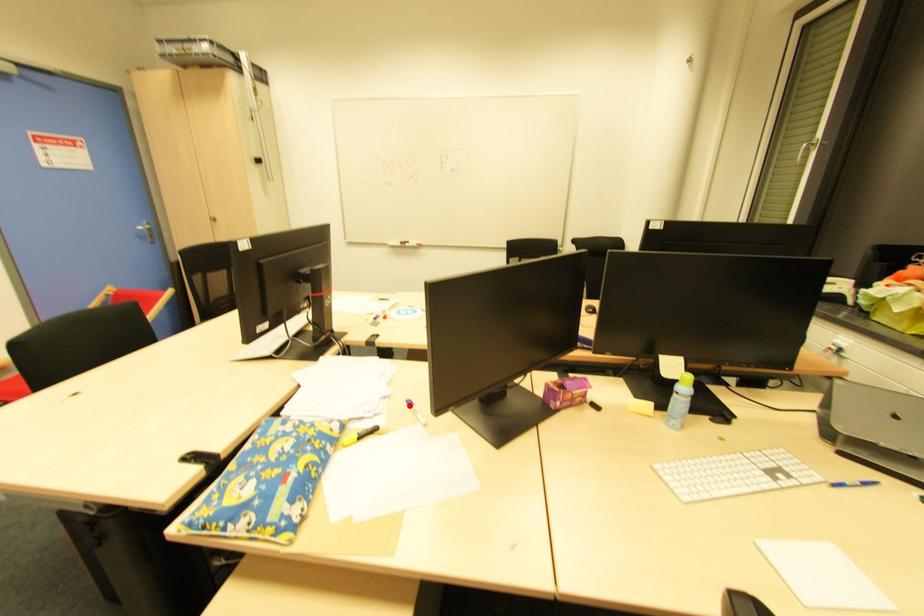
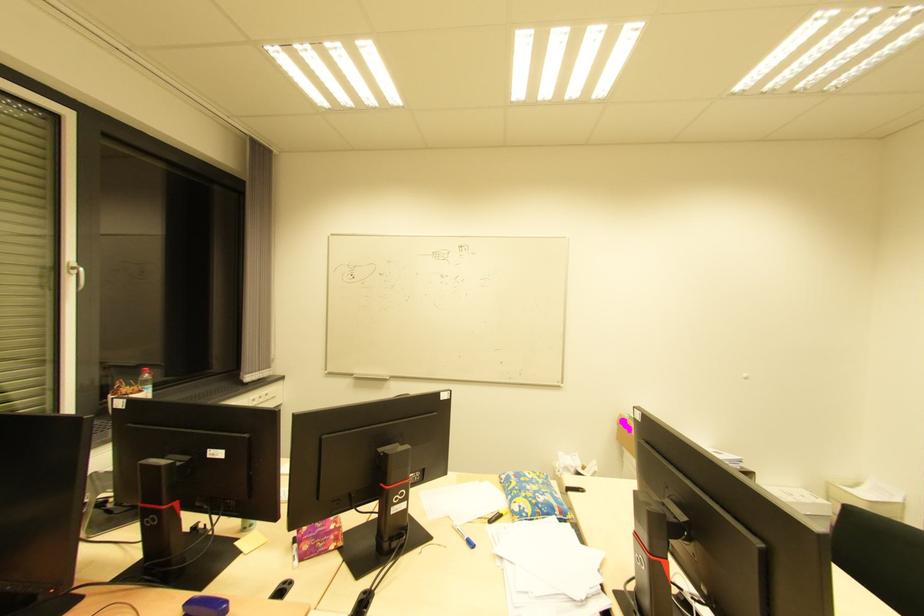
In the second image, find the point that corresponds to the highlighted location in the first image.

(470, 546)